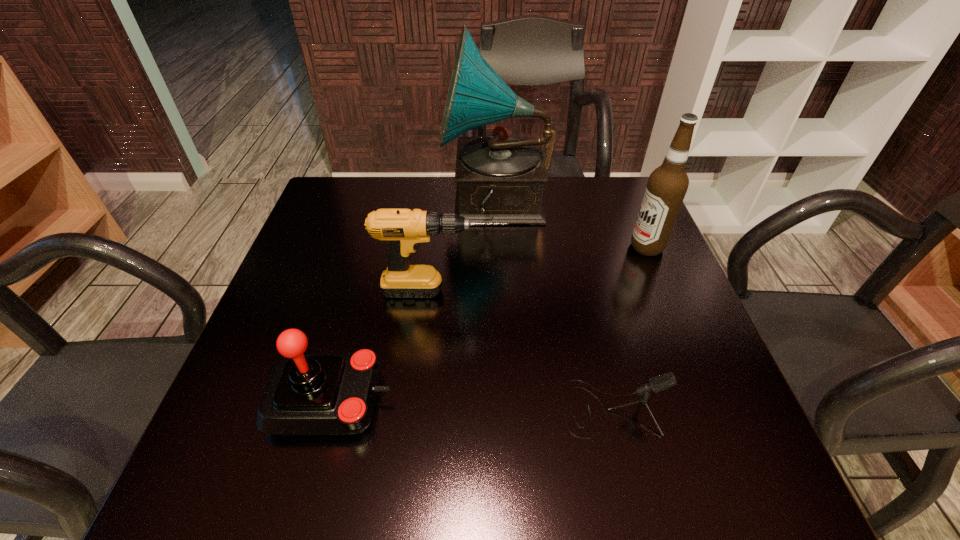
Where is `vacant space located 0.100m on the horn of the record player`? Image resolution: width=960 pixels, height=540 pixels. vacant space located 0.100m on the horn of the record player is located at coordinates (407, 203).

Identify the location of free space located on the label of the rightmost object. The height and width of the screenshot is (540, 960). (476, 247).

This screenshot has width=960, height=540. In order to click on free location located 0.120m on the label of the rightmost object in this screenshot , I will do `click(581, 247)`.

The image size is (960, 540). I want to click on vacant space located on the label of the rightmost object, so click(589, 247).

Where is `vacant area situated 0.210m at the tip of the third farthest object`? Image resolution: width=960 pixels, height=540 pixels. vacant area situated 0.210m at the tip of the third farthest object is located at coordinates (599, 291).

Locate an element on the screen. This screenshot has width=960, height=540. vacant space situated 0.080m on the base of the joystick is located at coordinates (437, 399).

Find the location of a particular element. This screenshot has height=540, width=960. vacant space located 0.090m on the stand of the shortest object is located at coordinates (511, 408).

Locate an element on the screen. blank space located on the stand of the shortest object is located at coordinates (437, 408).

At what (x,y) coordinates should I click in order to perform the action: click on vacant space positioned on the stand of the shortest object. Please return your answer as a coordinate pair (x, y). The width and height of the screenshot is (960, 540). Looking at the image, I should click on (454, 408).

Image resolution: width=960 pixels, height=540 pixels. Find the location of `object at the far edge`. object at the far edge is located at coordinates (500, 178).